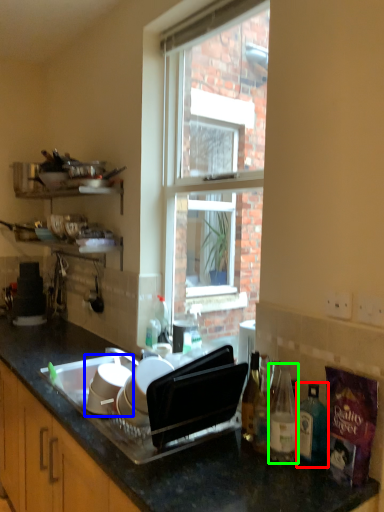
Question: Based on their relative distances, which object is farther from bottle (highlighted by a red box)? Choose from appliance (highlighted by a blue box) and bottle (highlighted by a green box).

Choices:
 (A) appliance
 (B) bottle

Answer: (A)